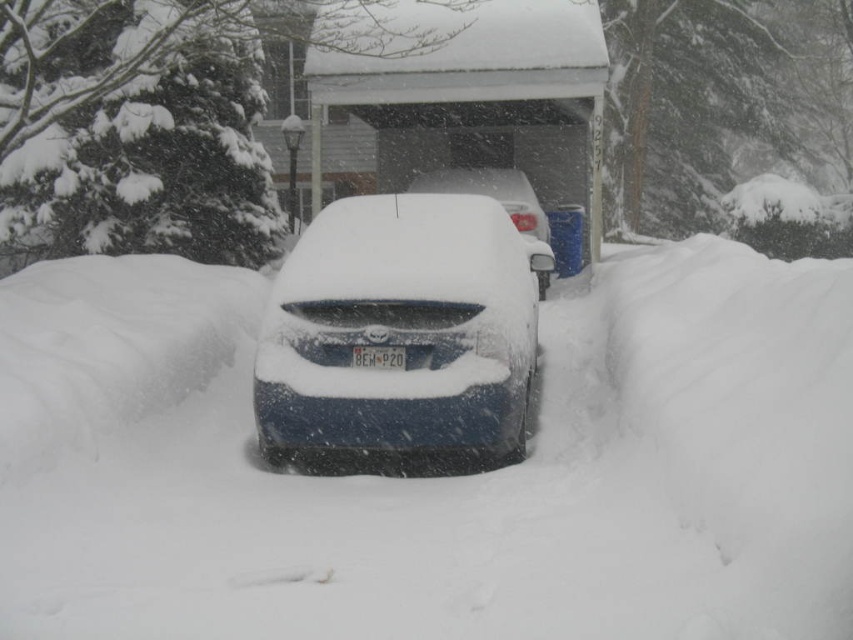
You are a delivery person who needs to place a package on the license plate to leave it for the homeowner. The package is 1 meter long. Is there enough space between the white fluffy snow at center and the white plastic license plate at center to place the package?

The distance between the white fluffy snow at center and the white plastic license plate at center is 92.09 centimeters. Since the package is 1 meter long, which is longer than the available space, the package cannot be placed between them.

You are a delivery person standing at the entrance of the garage. You need to place a package on the hood of the sleek blue sedan at center. Given that you can reach up to 1.8 meters from your current position, will you be able to reach the hood without moving closer?

The sleek blue sedan at center is 5.94 meters away from the camera. Since the delivery person can only reach up to 1.8 meters from their current position, they are too far to reach the hood without moving closer.

You are a delivery person trying to reach the front door of the house. You see the white fluffy snow at center and the sleek blue car at center. Which object is closer to the left side from your perspective?

The white fluffy snow at center is positioned on the left side of the sleek blue car at center, so it is closer to the left side from your perspective.